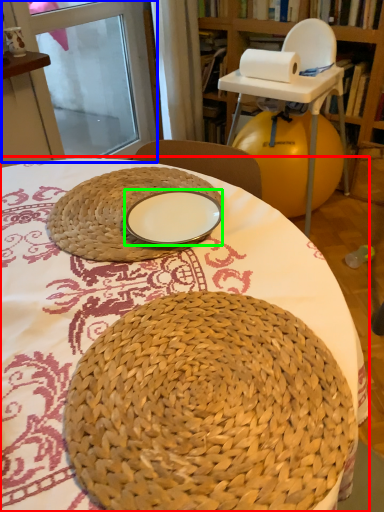
Question: Which object is positioned closest to table (highlighted by a red box)? Select from screen door (highlighted by a blue box) and plate (highlighted by a green box).

Choices:
 (A) screen door
 (B) plate

Answer: (B)